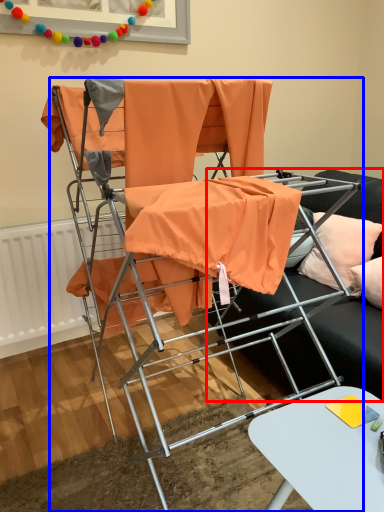
Question: Which object is further to the camera taking this photo, studio couch (highlighted by a red box) or chair (highlighted by a blue box)?

Choices:
 (A) studio couch
 (B) chair

Answer: (A)